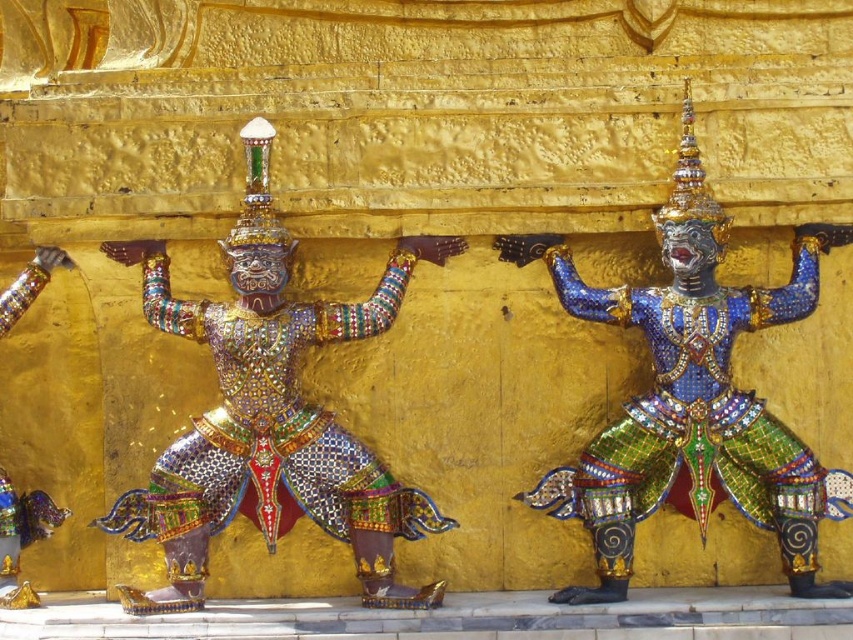
Is blue mosaic statue at center taller than shiny gold armor at left?

Indeed, blue mosaic statue at center has a greater height compared to shiny gold armor at left.

Is point (550, 266) in front of point (33, 282)?

Yes.

This screenshot has width=853, height=640. What are the coordinates of `blue mosaic statue at center` in the screenshot? It's located at (692, 396).

Is multicolored mosaic deity at center above shiny gold armor at left?

Yes, multicolored mosaic deity at center is above shiny gold armor at left.

Which is in front, point (335, 333) or point (30, 520)?

Point (335, 333) is more forward.

You are a GUI agent. You are given a task and a screenshot of the screen. Output one action in this format:
    pyautogui.click(x=<x>, y=<y>)
    Task: Click on the multicolored mosaic deity at center
    This screenshot has width=853, height=640.
    Given the screenshot: What is the action you would take?
    pyautogui.click(x=270, y=413)

Is multicolored mosaic deity at center below blue mosaic statue at center?

Correct, multicolored mosaic deity at center is located below blue mosaic statue at center.

Is multicolored mosaic deity at center wider than blue mosaic statue at center?

Yes, multicolored mosaic deity at center is wider than blue mosaic statue at center.

Where is `multicolored mosaic deity at center`? The image size is (853, 640). multicolored mosaic deity at center is located at coordinates point(270,413).